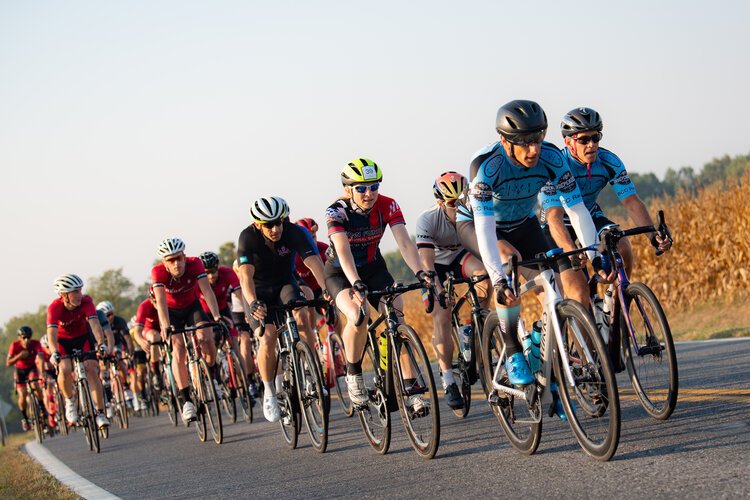
At what (x,y) coordinates should I click in order to perform the action: click on shoe. Please return your answer as a coordinate pair (x, y). Looking at the image, I should click on (357, 389), (280, 406), (195, 408), (112, 425), (66, 408), (512, 374), (531, 344), (454, 393), (412, 406).